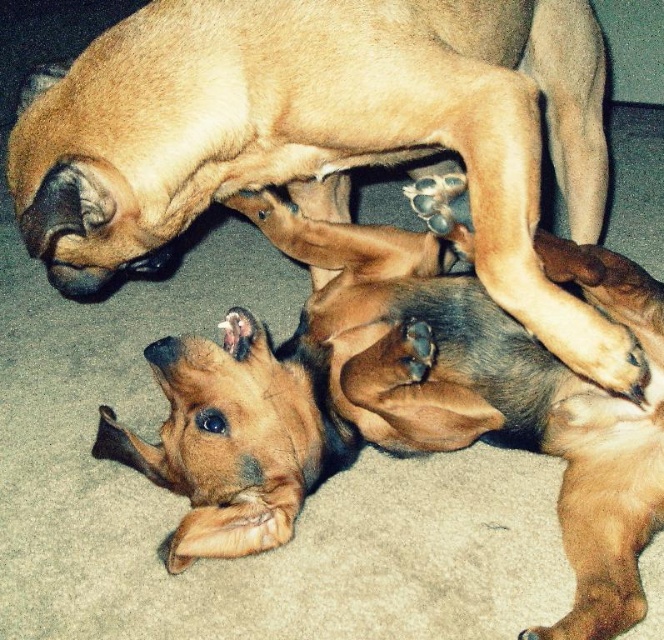
Question: Can you confirm if brown matte dog at center is bigger than brown furry dog at lower center?

Choices:
 (A) yes
 (B) no

Answer: (A)

Question: Which point is closer to the camera taking this photo?

Choices:
 (A) 307,444
 (B) 582,349

Answer: (B)

Question: Can you confirm if brown matte dog at center is positioned above brown furry dog at lower center?

Choices:
 (A) no
 (B) yes

Answer: (B)

Question: Can you confirm if brown matte dog at center is positioned above brown furry dog at lower center?

Choices:
 (A) no
 (B) yes

Answer: (B)